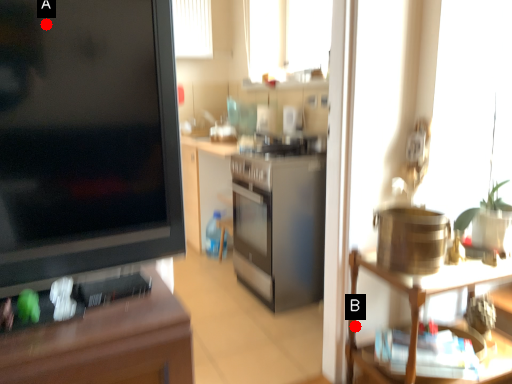
Question: Two points are circled on the image, labeled by A and B beside each circle. Which point is closer to the camera?

Choices:
 (A) A is closer
 (B) B is closer

Answer: (A)